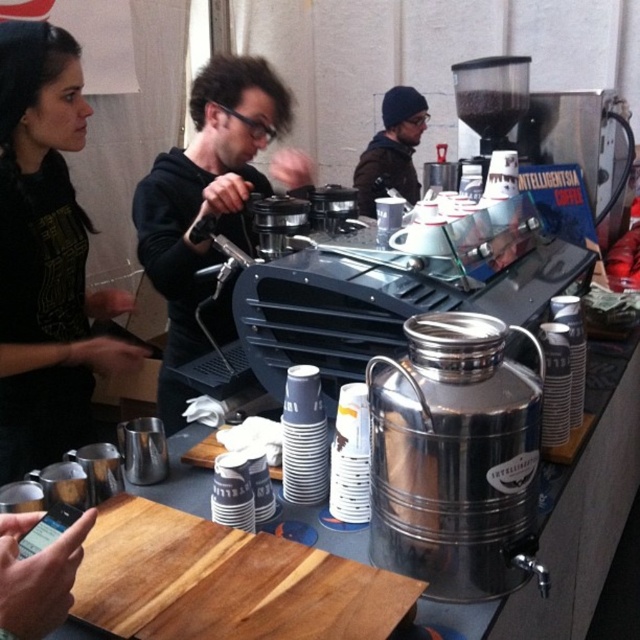
Does point (49, 339) lie in front of point (420, 97)?

That is True.

You are a GUI agent. You are given a task and a screenshot of the screen. Output one action in this format:
    pyautogui.click(x=<x>, y=<y>)
    Task: Click on the black fabric shirt at left
    The height and width of the screenshot is (640, 640).
    Given the screenshot: What is the action you would take?
    pyautogui.click(x=45, y=256)

Does brown fuzzy beanie at upper center lie behind metallic silver grinder at upper right?

Yes.

Between brown fuzzy beanie at upper center and metallic silver grinder at upper right, which one is positioned higher?

brown fuzzy beanie at upper center is higher up.

Is point (374, 160) positioned in front of point (483, 102)?

No, it is behind (483, 102).

The image size is (640, 640). In order to click on brown fuzzy beanie at upper center in this screenshot , I will do `click(392, 150)`.

Locate an element on the screen. This screenshot has height=640, width=640. black matte hoodie at center is located at coordinates (204, 202).

Does black matte hoodie at center come behind metallic silver grinder at upper right?

That is False.

Is point (262, 60) farther from camera compared to point (486, 68)?

That is True.

This screenshot has width=640, height=640. Find the location of `black matte hoodie at center`. black matte hoodie at center is located at coordinates point(204,202).